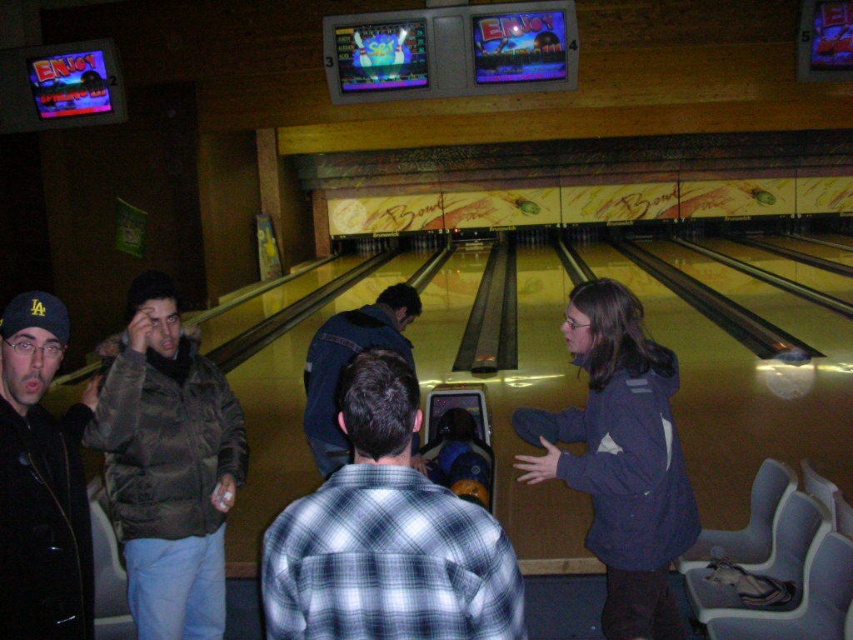
Consider the image. Who is positioned more to the right, brown fuzzy jacket at left or dark blue jeans at center?

Positioned to the right is dark blue jeans at center.

Which is in front, point (151, 456) or point (410, 314)?

Point (151, 456)

Locate an element on the screen. brown fuzzy jacket at left is located at coordinates (167, 465).

Does plaid cotton shirt at center have a greater height compared to dark blue jeans at center?

Incorrect, plaid cotton shirt at center's height is not larger of dark blue jeans at center's.

Does plaid cotton shirt at center appear over dark blue jeans at center?

No.

Does point (296, 557) come in front of point (332, 348)?

Yes, it is in front of point (332, 348).

Image resolution: width=853 pixels, height=640 pixels. Identify the location of plaid cotton shirt at center. pos(386,536).

Does point (276, 566) lie behind point (39, 371)?

No, it is not.

Measure the distance between plaid cotton shirt at center and camera.

plaid cotton shirt at center is 4.62 feet away from camera.

Who is more forward, [299,580] or [20,433]?

Point [299,580] is more forward.

Image resolution: width=853 pixels, height=640 pixels. Find the location of `plaid cotton shirt at center`. plaid cotton shirt at center is located at coordinates (386, 536).